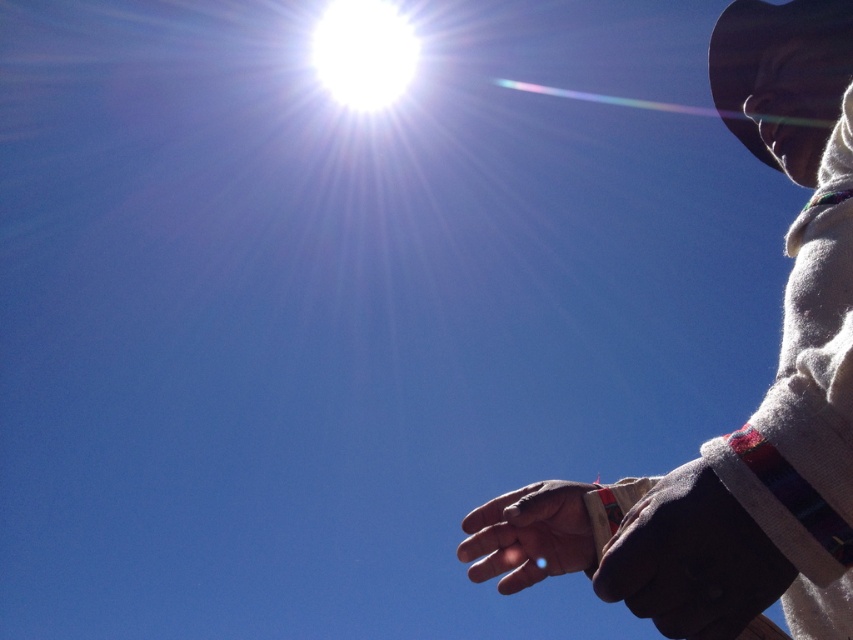
Question: Does white woolen sweater at right come in front of leather wristwatch at lower right?

Choices:
 (A) no
 (B) yes

Answer: (B)

Question: Which object is positioned closest to the leather wristwatch at lower right?

Choices:
 (A) white bright at upper center
 (B) white woolen sweater at right

Answer: (B)

Question: Estimate the real-world distances between objects in this image. Which object is closer to the brown leather hand at lower right?

Choices:
 (A) leather wristwatch at lower right
 (B) white bright at upper center

Answer: (A)

Question: Does leather wristwatch at lower right come in front of white bright at upper center?

Choices:
 (A) yes
 (B) no

Answer: (A)

Question: Does leather wristwatch at lower right have a lesser width compared to white bright at upper center?

Choices:
 (A) no
 (B) yes

Answer: (B)

Question: Which object is positioned closest to the leather wristwatch at lower right?

Choices:
 (A) brown leather hand at lower right
 (B) white bright at upper center
 (C) white woolen sweater at right

Answer: (C)